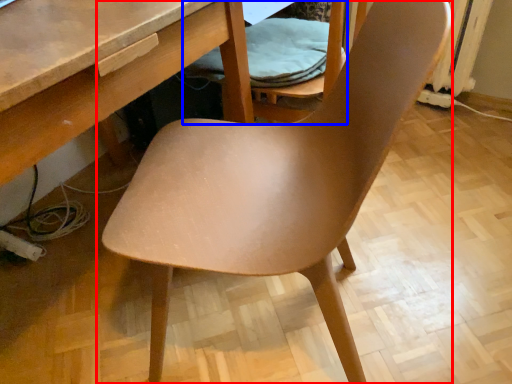
Question: Among these objects, which one is farthest to the camera, chair (highlighted by a red box) or folding chair (highlighted by a blue box)?

Choices:
 (A) chair
 (B) folding chair

Answer: (B)